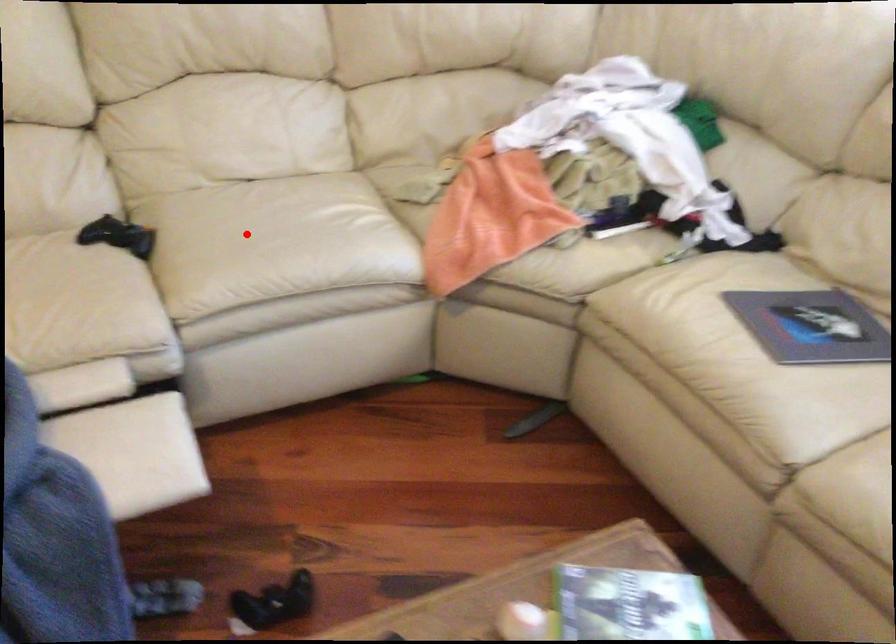
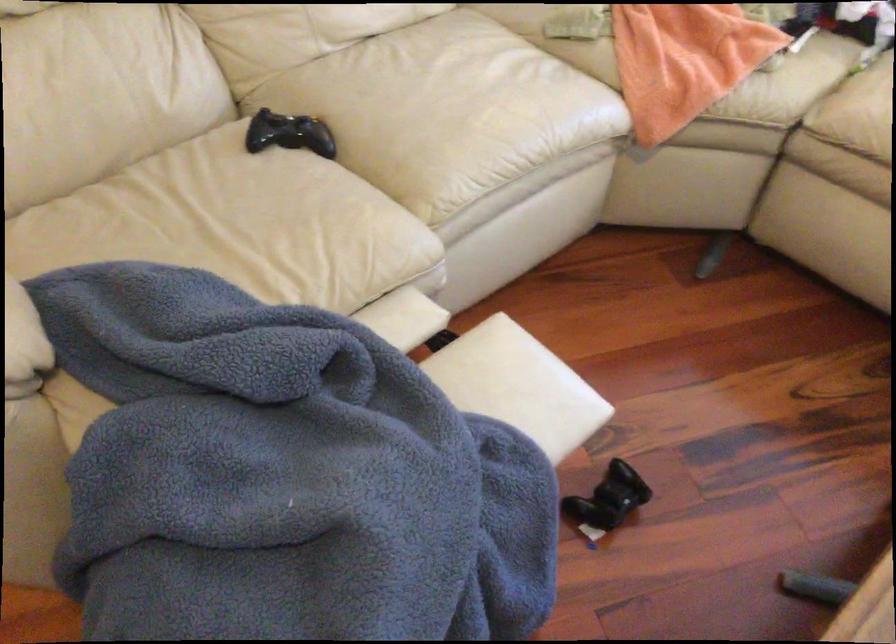
Question: A red point is marked in image1. In image2, is the corresponding 3D point closer to the camera or farther? Reply with the corresponding letter.

Choices:
 (A) The corresponding 3D point is closer.
 (B) The corresponding 3D point is farther.

Answer: (A)